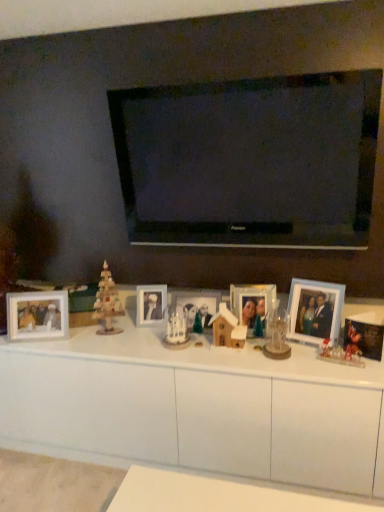
Where is `vacant space to the right of translucent plastic gingerbread house at lower right, the 2th toy positioned from the back`? vacant space to the right of translucent plastic gingerbread house at lower right, the 2th toy positioned from the back is located at coordinates (363, 364).